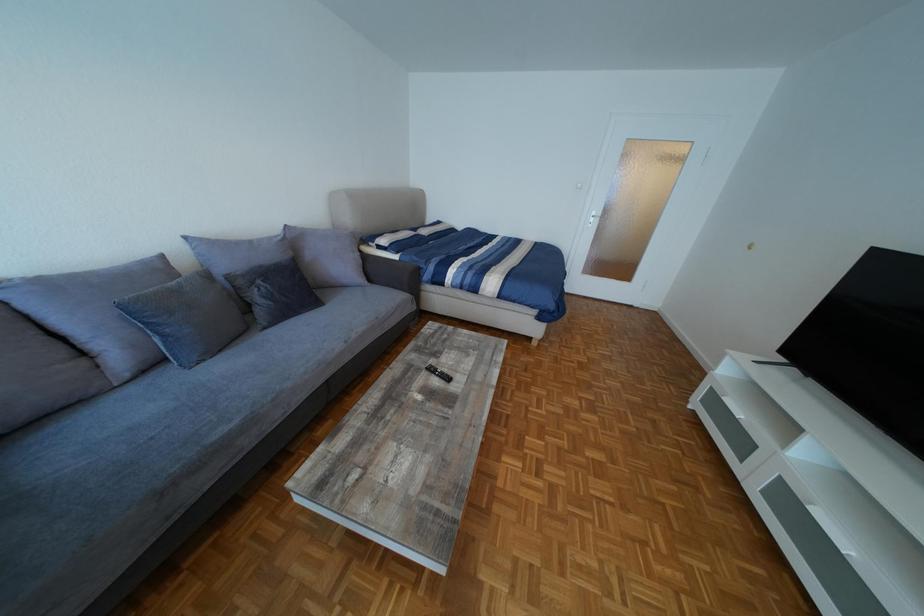
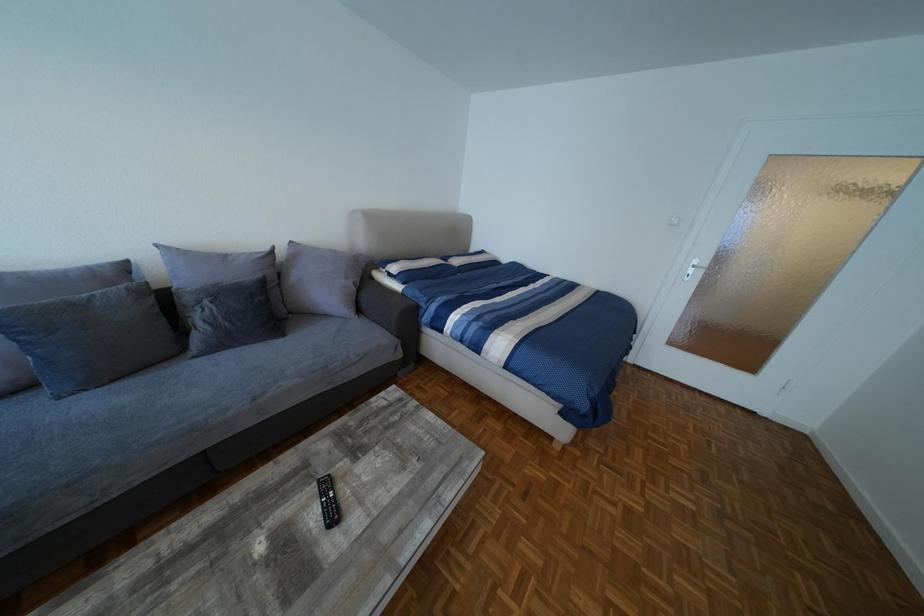
In a continuous first-person perspective shot, in which direction is the camera moving?

The cameraman moved toward right, forward.